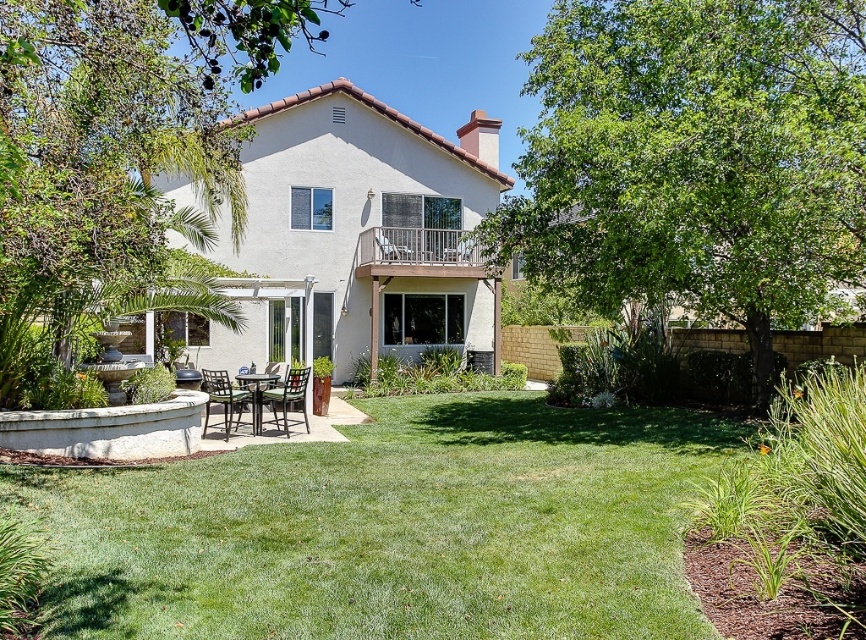
Question: Considering the real-world distances, which object is farthest from the brown wooden chair at lower center?

Choices:
 (A) green leafy tree at center
 (B) brown woven chair at center
 (C) green leafy tree at upper left

Answer: (A)

Question: Can you confirm if brown wooden chair at lower center is smaller than metallic silver chair at center?

Choices:
 (A) yes
 (B) no

Answer: (B)

Question: Where is green leafy tree at center located in relation to green leafy tree at upper left in the image?

Choices:
 (A) left
 (B) right

Answer: (B)

Question: Can you confirm if green leafy tree at center is smaller than green leafy tree at upper left?

Choices:
 (A) no
 (B) yes

Answer: (B)

Question: Which of the following is the closest to the observer?

Choices:
 (A) brown wooden chair at lower center
 (B) green leafy tree at upper left

Answer: (B)

Question: Which of these objects is positioned farthest from the brown wooden chair at lower center?

Choices:
 (A) metallic silver chair at center
 (B) green leafy tree at center

Answer: (B)